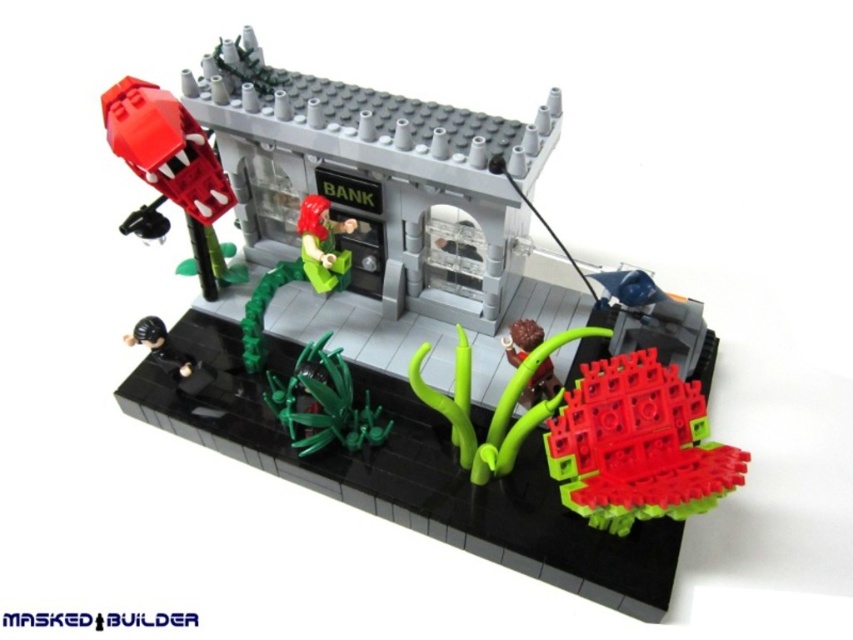
What do you see at coordinates (637, 445) in the screenshot? The image size is (853, 640). I see `translucent red plastic plant at lower right` at bounding box center [637, 445].

Is translucent red plastic plant at lower right closer to the viewer compared to green matte figure at center?

Yes, translucent red plastic plant at lower right is closer to the viewer.

Is point (635, 403) positioned before point (326, 227)?

Yes, it is in front of point (326, 227).

The image size is (853, 640). Identify the location of translucent red plastic plant at lower right. (637, 445).

Does matte red robot at upper left appear under green matte figure at center?

Yes.

Is matte red robot at upper left in front of green matte figure at center?

Yes, matte red robot at upper left is in front of green matte figure at center.

Does point (699, 422) come behind point (346, 262)?

No, (699, 422) is in front of (346, 262).

Where is `matte red robot at upper left`? The height and width of the screenshot is (640, 853). matte red robot at upper left is located at coordinates (422, 336).

Who is shorter, translucent red plastic plant at lower right or green matte plant at center?

Standing shorter between the two is green matte plant at center.

Between translucent red plastic plant at lower right and green matte plant at center, which one appears on the right side from the viewer's perspective?

translucent red plastic plant at lower right

Who is more forward, (698, 400) or (334, 417)?

Point (698, 400) is more forward.

Where is `translucent red plastic plant at lower right`? The width and height of the screenshot is (853, 640). translucent red plastic plant at lower right is located at coordinates (637, 445).